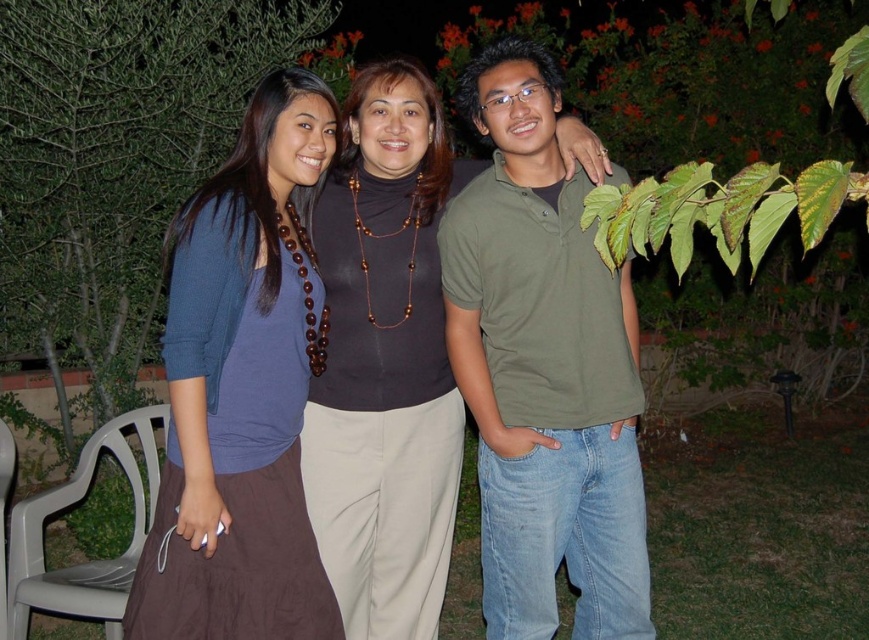
Is green cotton polo shirt at center above green leafy tree at upper center?

Incorrect, green cotton polo shirt at center is not positioned above green leafy tree at upper center.

Between point (567, 342) and point (36, 289), which one is positioned behind?

The point (36, 289) is behind.

Identify the location of green cotton polo shirt at center. (542, 369).

Who is lower down, matte blue blouse at center or brown/beaded necklace at center?

brown/beaded necklace at center is below.

This screenshot has height=640, width=869. Find the location of `matte blue blouse at center`. matte blue blouse at center is located at coordinates (242, 388).

Does green leafy tree at upper center have a lesser width compared to brown/beaded necklace at center?

Incorrect, green leafy tree at upper center's width is not less than brown/beaded necklace at center's.

Does green leafy tree at upper center have a larger size compared to brown/beaded necklace at center?

Indeed, green leafy tree at upper center has a larger size compared to brown/beaded necklace at center.

Is point (75, 300) more distant than point (342, 168)?

Yes, point (75, 300) is behind point (342, 168).

In order to click on green leafy tree at upper center in this screenshot , I will do `click(116, 161)`.